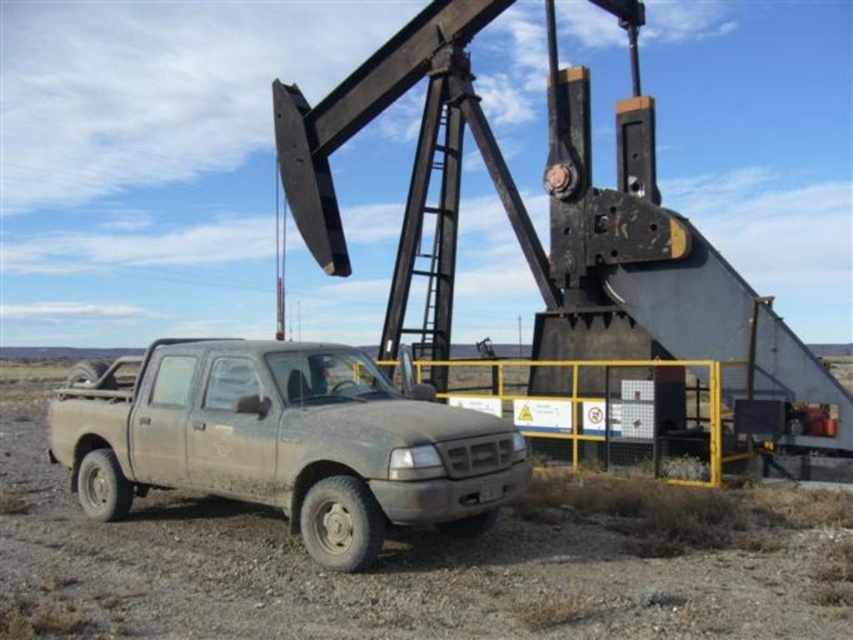
Question: Which of the following is the closest to the observer?

Choices:
 (A) (113, 568)
 (B) (396, 454)

Answer: (B)

Question: Is the position of dull gray dirt field at center less distant than that of dusty matte pickup truck at lower left?

Choices:
 (A) no
 (B) yes

Answer: (B)

Question: Is the position of dull gray dirt field at center less distant than that of dusty matte pickup truck at lower left?

Choices:
 (A) no
 (B) yes

Answer: (B)

Question: Does dull gray dirt field at center have a greater width compared to dusty matte pickup truck at lower left?

Choices:
 (A) yes
 (B) no

Answer: (A)

Question: Which of the following is the farthest from the observer?

Choices:
 (A) dull gray dirt field at center
 (B) dusty matte pickup truck at lower left

Answer: (B)